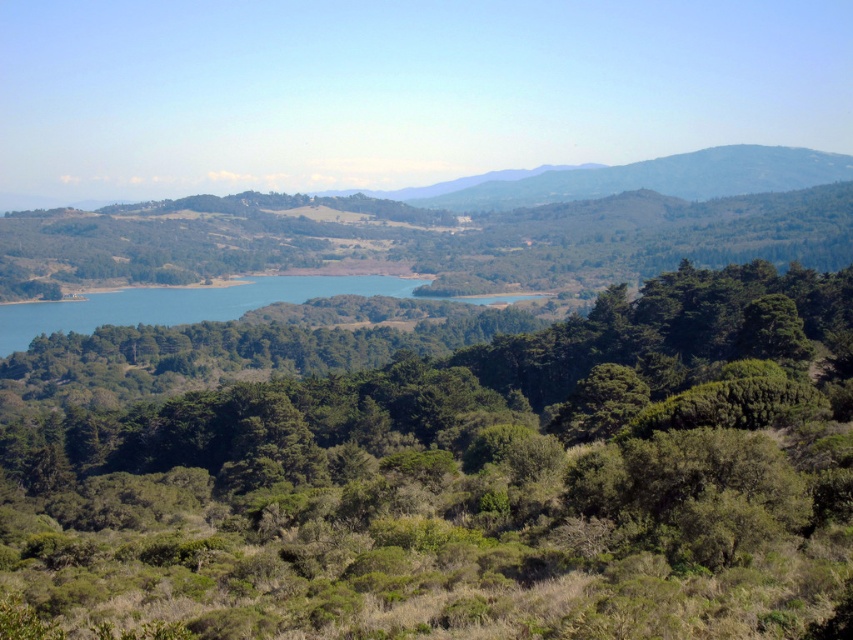
You are standing in a forest and see the green leafy tree at center and the blue water at center. Which object is nearer to you?

The green leafy tree at center is closer to the viewer than the blue water at center.

You are standing at the point marked by coordinates point [469,484] in the image. What type of vegetation are you surrounded by?

The point [469,484] marks a green leafy tree at center, so you are surrounded by green leafy trees.

You are planning to take a photo of the green leafy tree at center and the blue water at center. Which object should you focus on first if you want both to be in sharp focus?

The green leafy tree at center is larger in size than the blue water at center, so you should focus on the larger object first to ensure both are in sharp focus.